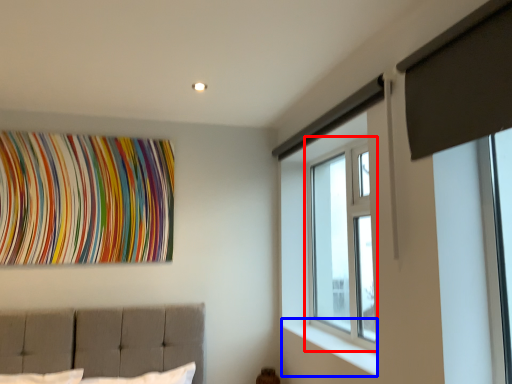
Question: Which of the following is the closest to the observer, window (highlighted by a red box) or window sill (highlighted by a blue box)?

Choices:
 (A) window
 (B) window sill

Answer: (B)